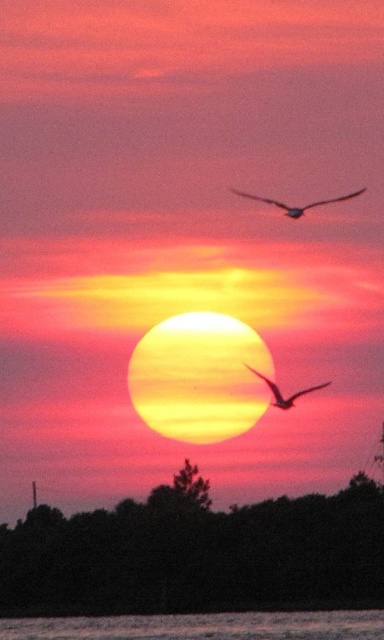
Question: Is silhouette feathered bird at upper center below silhouette feathered bird at center?

Choices:
 (A) yes
 (B) no

Answer: (B)

Question: Is dark green leafy trees at lower center closer to camera compared to smooth water at lower center?

Choices:
 (A) yes
 (B) no

Answer: (B)

Question: Which point is farther from the camera taking this photo?

Choices:
 (A) (284, 204)
 (B) (281, 403)
 (C) (241, 612)
 (D) (144, 541)

Answer: (D)

Question: Which of these objects is positioned closest to the silhouette feathered bird at upper center?

Choices:
 (A) smooth water at lower center
 (B) dark green leafy trees at lower center
 (C) silhouette feathered bird at center

Answer: (C)

Question: Based on their relative distances, which object is farther from the dark green leafy trees at lower center?

Choices:
 (A) smooth water at lower center
 (B) silhouette feathered bird at upper center
 (C) silhouette feathered bird at center

Answer: (B)

Question: Is smooth water at lower center thinner than silhouette feathered bird at upper center?

Choices:
 (A) yes
 (B) no

Answer: (B)